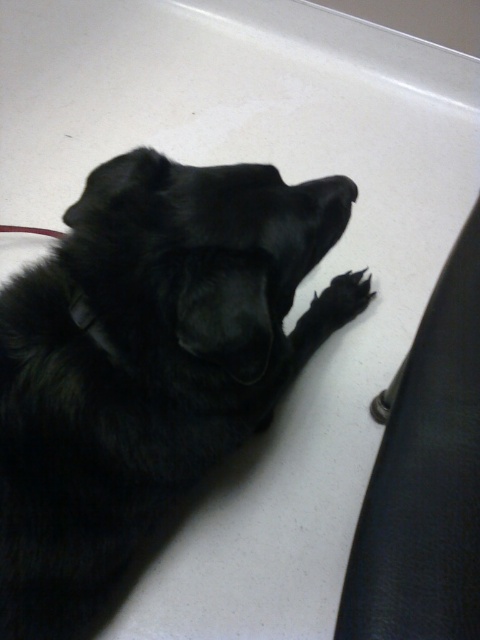
Where is the black fluffy dog at center located in the image?

The black fluffy dog at center is located at point [143,362] in the image.

You are a dog groomer observing the black fluffy dog at center and the black fur paw at lower right. Which object is wider?

The black fluffy dog at center is wider than the black fur paw at lower right.

You are a photographer setting up a shoot in the scene. You need to position a small light source between the black fluffy dog at center and the black fur paw at lower right. Is the space between them sufficient to place the light?

The black fluffy dog at center is below the black fur paw at lower right, so there is vertical space between them. However, the description does not provide information about the horizontal distance. Without knowing the horizontal space, it is uncertain if the light can be placed between them.